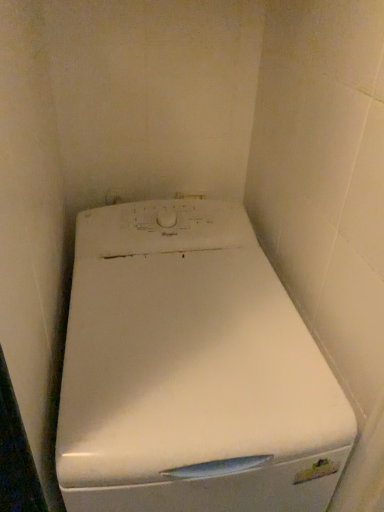
The width and height of the screenshot is (384, 512). Describe the element at coordinates (191, 371) in the screenshot. I see `white matte washing machine at center` at that location.

The height and width of the screenshot is (512, 384). What are the coordinates of `white matte washing machine at center` in the screenshot? It's located at (191, 371).

In order to face white matte washing machine at center, should I rotate leftwards or rightwards?

A 1.989 degree turn to the left will do.

Locate an element on the screen. The width and height of the screenshot is (384, 512). white matte washing machine at center is located at coordinates (191, 371).